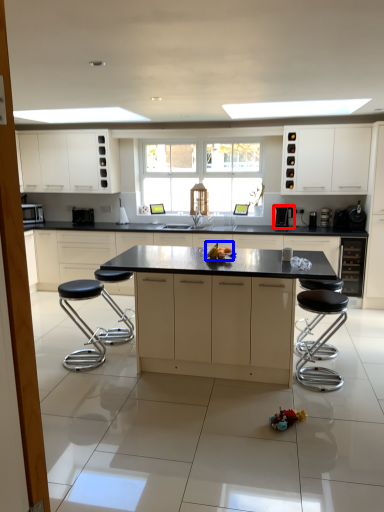
Question: Which object appears closest to the camera in this image, coffee machine (highlighted by a red box) or food (highlighted by a blue box)?

Choices:
 (A) coffee machine
 (B) food

Answer: (B)